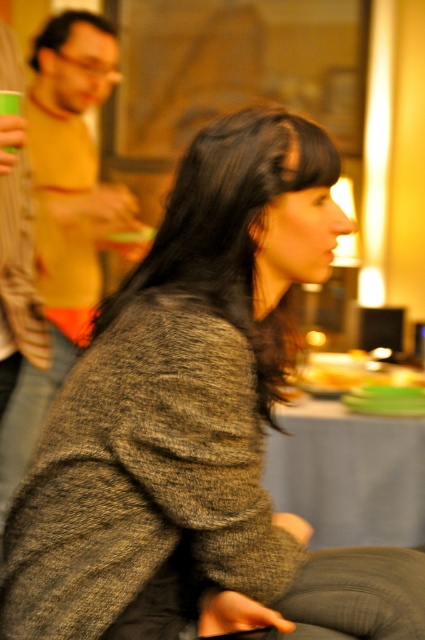
What object is located at the coordinates point [64,214]?

The object at point [64,214] is the matte yellow shirt at left.